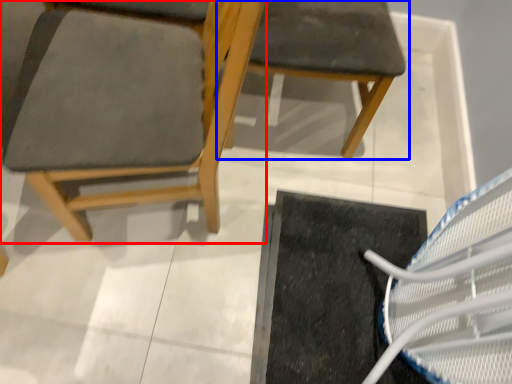
Question: Which point is further to the camera, chair (highlighted by a red box) or chair (highlighted by a blue box)?

Choices:
 (A) chair
 (B) chair

Answer: (B)